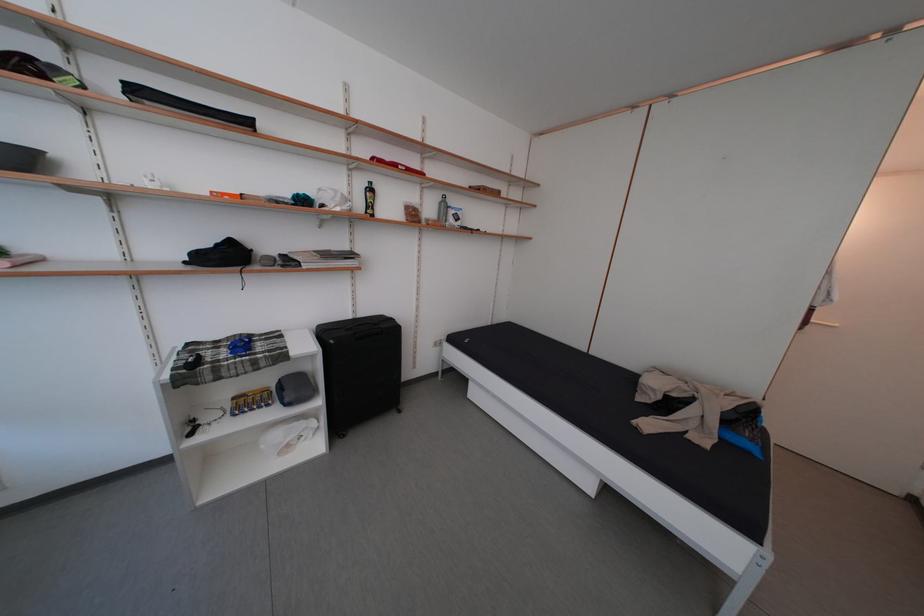
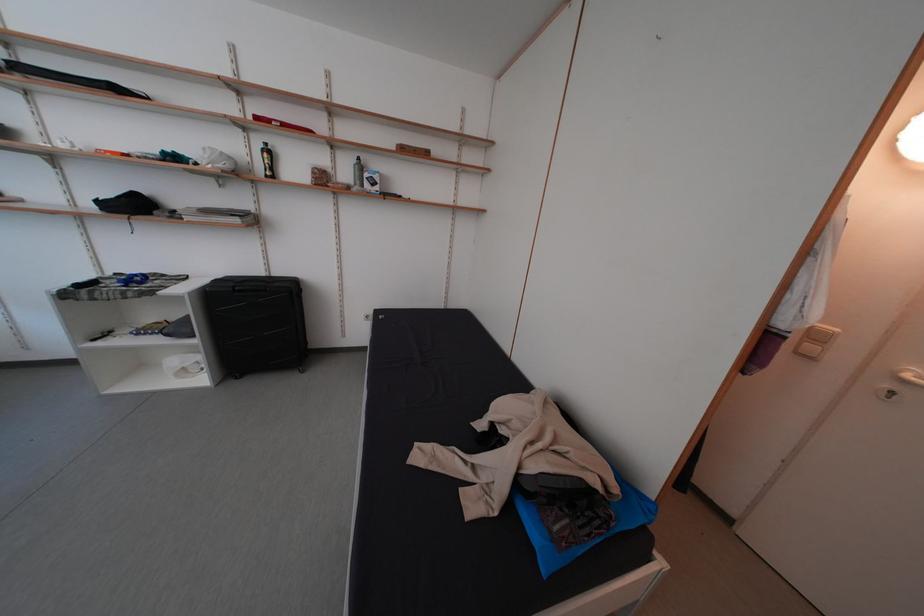
Find the pixel in the second image that matches (x=439, y=216) in the first image.

(354, 179)